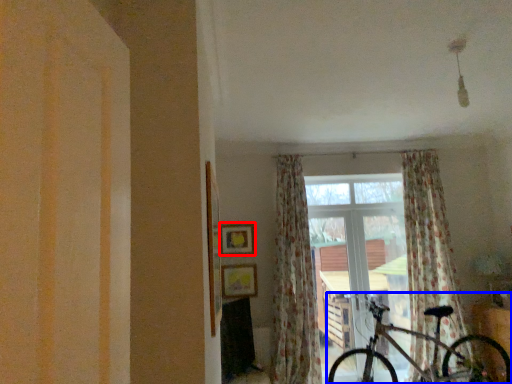
Question: Which object appears closest to the camera in this image, picture frame (highlighted by a red box) or bicycle (highlighted by a blue box)?

Choices:
 (A) picture frame
 (B) bicycle

Answer: (B)